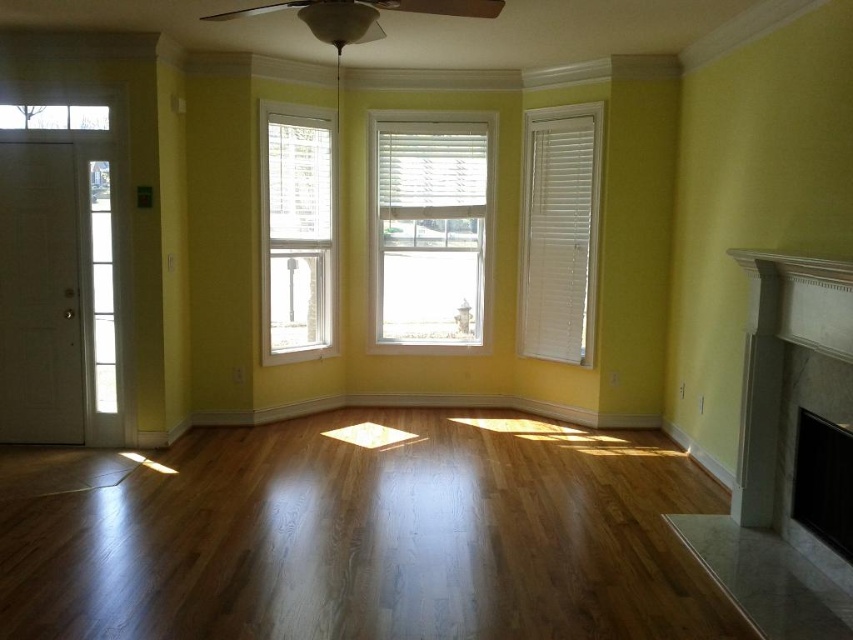
You are standing in the center of the room and want to reach both the white marble fireplace at right and the white matte window at center. Which object is closer to you?

The white matte window at center is closer to you since you are standing in the center of the room, and the white marble fireplace at right is 9.37 feet away from the white matte window at center, indicating the fireplace is farther away.

You are an interior designer planning to install a new curtain rod for the white matte window at center and the white wood blinds at right. Considering their sizes, which object requires a longer curtain rod?

The white wood blinds at right requires a longer curtain rod because it is larger in size than the white matte window at center.